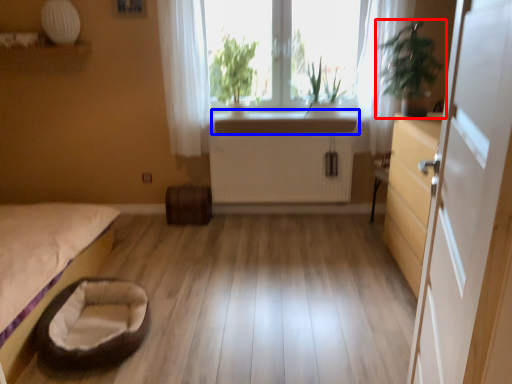
Question: Among these objects, which one is nearest to the camera, houseplant (highlighted by a red box) or counter top (highlighted by a blue box)?

Choices:
 (A) houseplant
 (B) counter top

Answer: (A)